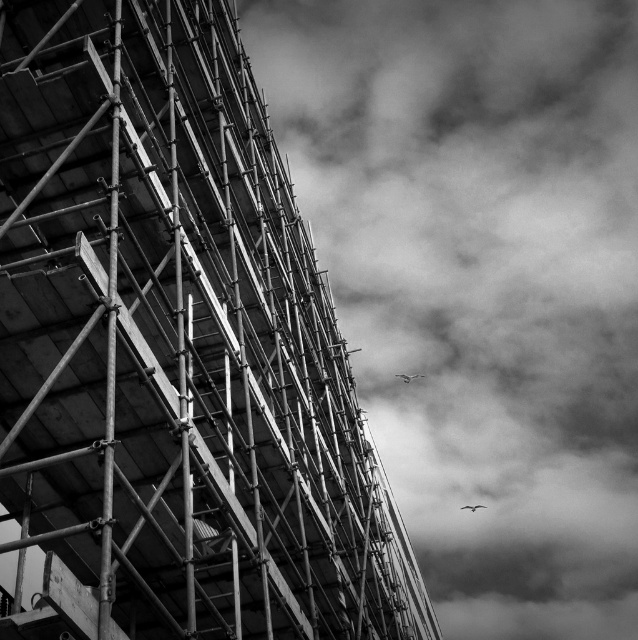
Between point (591, 429) and point (477, 502), which one is positioned in front?

Positioned in front is point (477, 502).

The height and width of the screenshot is (640, 638). I want to click on cloudy sky at upper right, so click(480, 282).

Is metal scaffolding at left below white feathered bird at upper right?

Actually, metal scaffolding at left is above white feathered bird at upper right.

Does metal scaffolding at left appear over white feathered bird at upper right?

Correct, metal scaffolding at left is located above white feathered bird at upper right.

The width and height of the screenshot is (638, 640). I want to click on metal scaffolding at left, so click(x=174, y=352).

Find the location of `metal scaffolding at left`. metal scaffolding at left is located at coordinates (174, 352).

Identify the location of metal scaffolding at left. The height and width of the screenshot is (640, 638). (174, 352).

At what (x,y) coordinates should I click in order to perform the action: click on metal scaffolding at left. Please return your answer as a coordinate pair (x, y). The height and width of the screenshot is (640, 638). Looking at the image, I should click on (174, 352).